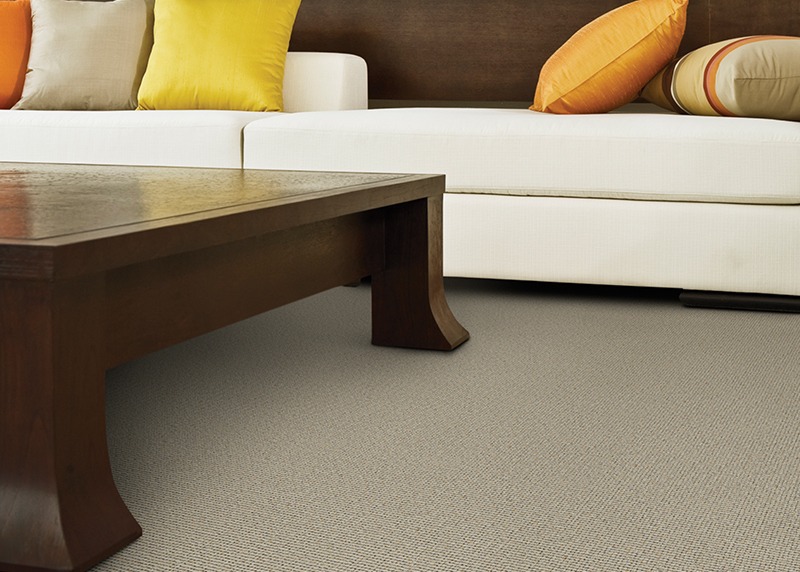
Image resolution: width=800 pixels, height=572 pixels. In order to click on floor in this screenshot , I will do `click(548, 412)`.